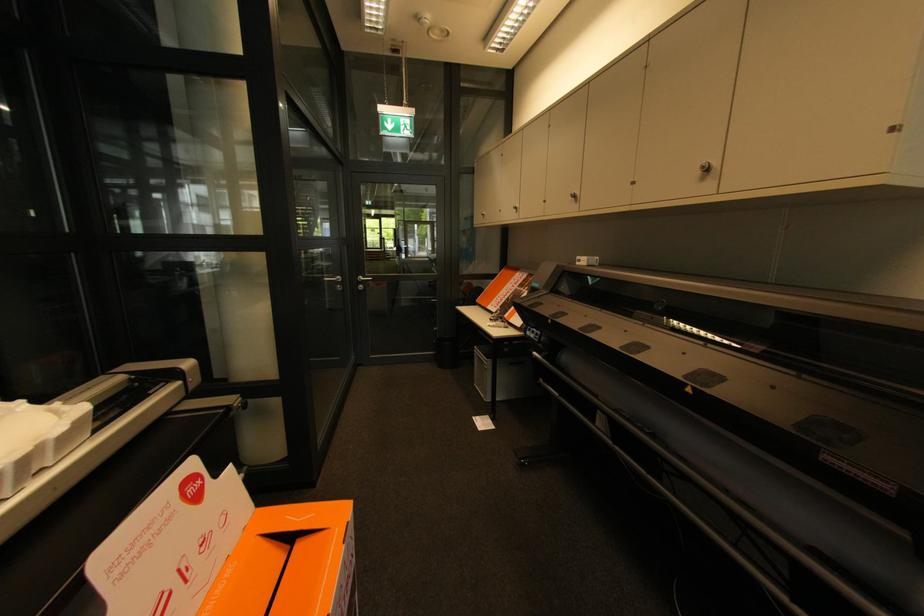
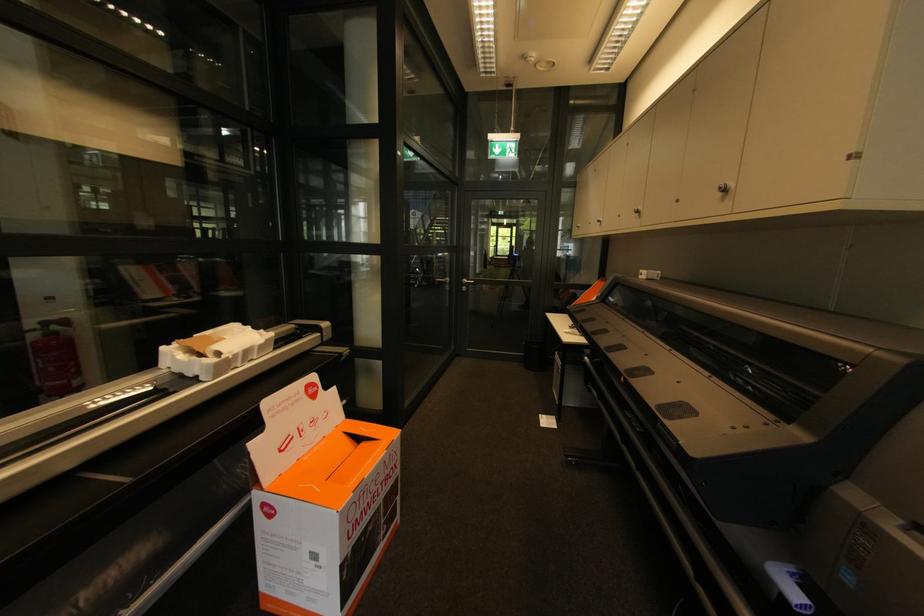
Find the pixel in the second image that matches pixel 578 198 in the first image.

(640, 214)